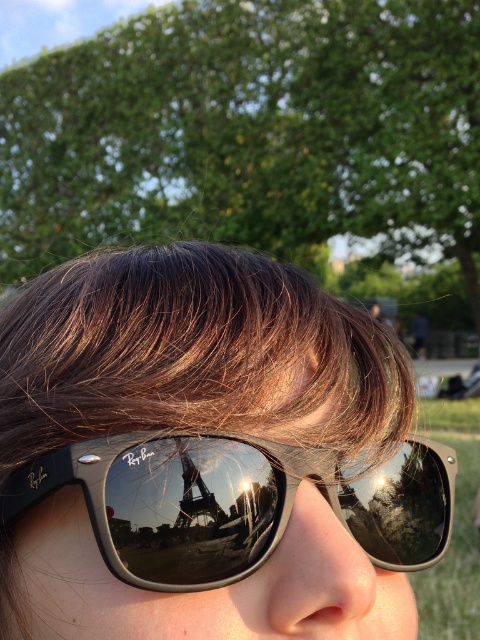
Does black matte sunglasses at center appear on the left side of black reflective sunglasses at center?

Yes, black matte sunglasses at center is to the left of black reflective sunglasses at center.

The height and width of the screenshot is (640, 480). What do you see at coordinates (207, 456) in the screenshot?
I see `black matte sunglasses at center` at bounding box center [207, 456].

Which is behind, point (396, 358) or point (144, 531)?

Positioned behind is point (396, 358).

Identify the location of black matte sunglasses at center. (207, 456).

Can you confirm if black matte sunglasses at center is thinner than glossy metallic eiffel tower at center?

In fact, black matte sunglasses at center might be wider than glossy metallic eiffel tower at center.

Where is `black matte sunglasses at center`? The height and width of the screenshot is (640, 480). black matte sunglasses at center is located at coordinates (207, 456).

Find the location of a particular element. The height and width of the screenshot is (640, 480). black matte sunglasses at center is located at coordinates (207, 456).

Is black reflective sunglasses at center above glossy metallic eiffel tower at center?

Actually, black reflective sunglasses at center is below glossy metallic eiffel tower at center.

Where is `black reflective sunglasses at center`? The width and height of the screenshot is (480, 640). black reflective sunglasses at center is located at coordinates (236, 502).

Where is `black reflective sunglasses at center`? black reflective sunglasses at center is located at coordinates (236, 502).